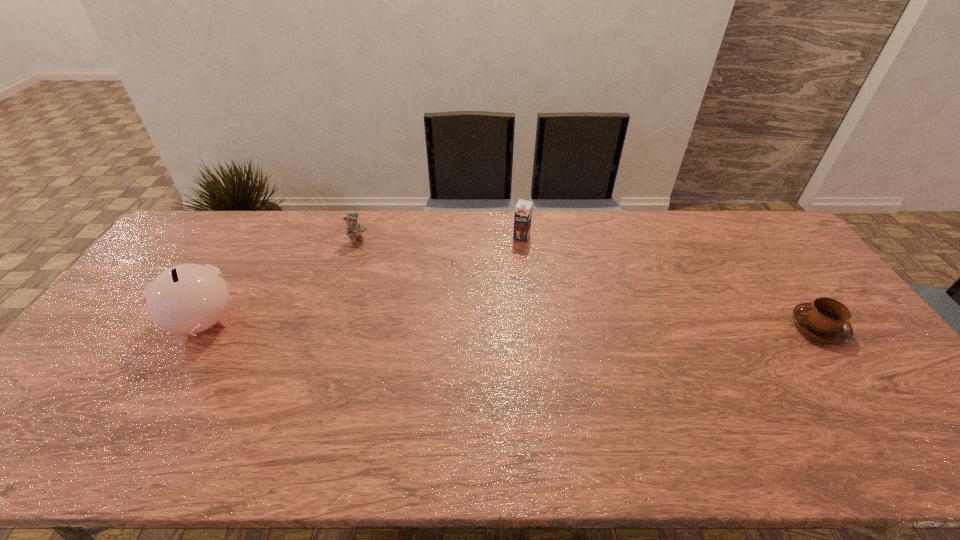
You are a GUI agent. You are given a task and a screenshot of the screen. Output one action in this format:
    pyautogui.click(x=<x>, y=<y>)
    Task: Click on the piggy bank
    This screenshot has width=960, height=540.
    Given the screenshot: What is the action you would take?
    pyautogui.click(x=185, y=299)

The width and height of the screenshot is (960, 540). I want to click on the tallest object, so click(x=185, y=299).

The width and height of the screenshot is (960, 540). Find the location of `cappuccino`. cappuccino is located at coordinates (826, 319).

This screenshot has width=960, height=540. Identify the location of the rightmost object. (826, 319).

Locate an element on the screen. This screenshot has width=960, height=540. the second tallest object is located at coordinates (523, 210).

Locate an element on the screen. the second object from right to left is located at coordinates (523, 210).

You are a GUI agent. You are given a task and a screenshot of the screen. Output one action in this format:
    pyautogui.click(x=<x>, y=<y>)
    Task: Click on the third tallest object
    This screenshot has width=960, height=540.
    Given the screenshot: What is the action you would take?
    pyautogui.click(x=354, y=229)

Locate an element on the screen. teddy bear is located at coordinates (354, 229).

Identify the location of free spot located 0.290m on the back of the tallest object. The image size is (960, 540). (256, 235).

Identify the location of vacant region located on the side of the shortest object with the handle. This screenshot has height=540, width=960. (657, 327).